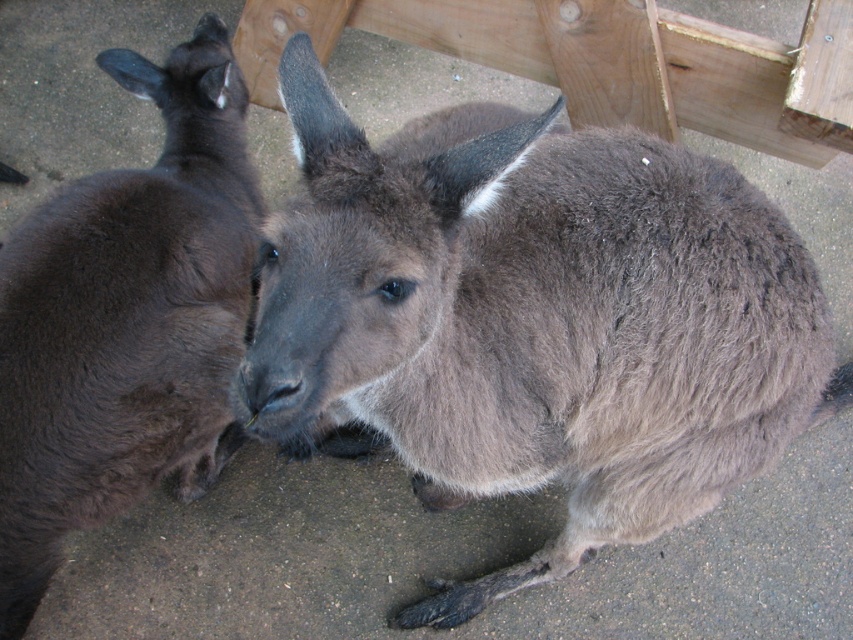
Question: Is gray furry kangaroo at center bigger than dark brown fur at left?

Choices:
 (A) no
 (B) yes

Answer: (B)

Question: Is gray furry kangaroo at center closer to camera compared to dark brown fur at left?

Choices:
 (A) yes
 (B) no

Answer: (A)

Question: Observing the image, what is the correct spatial positioning of gray furry kangaroo at center in reference to dark brown fur at left?

Choices:
 (A) above
 (B) below

Answer: (B)

Question: Which object appears closest to the camera in this image?

Choices:
 (A) dark brown fur at left
 (B) gray furry kangaroo at center

Answer: (B)